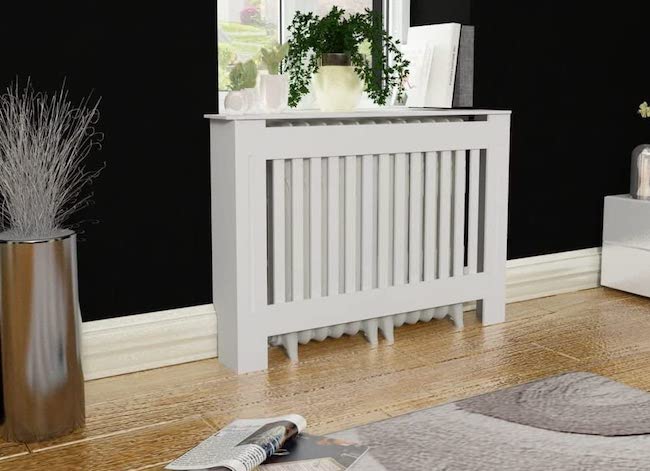
Locate an element on the screen. This screenshot has height=471, width=650. plant is located at coordinates (335, 33), (641, 105), (270, 54), (242, 70), (28, 167).